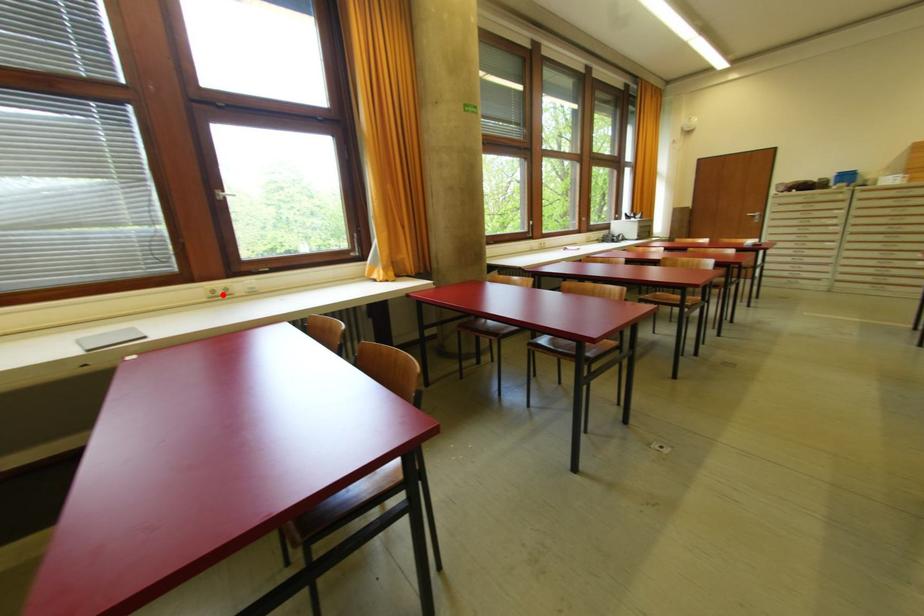
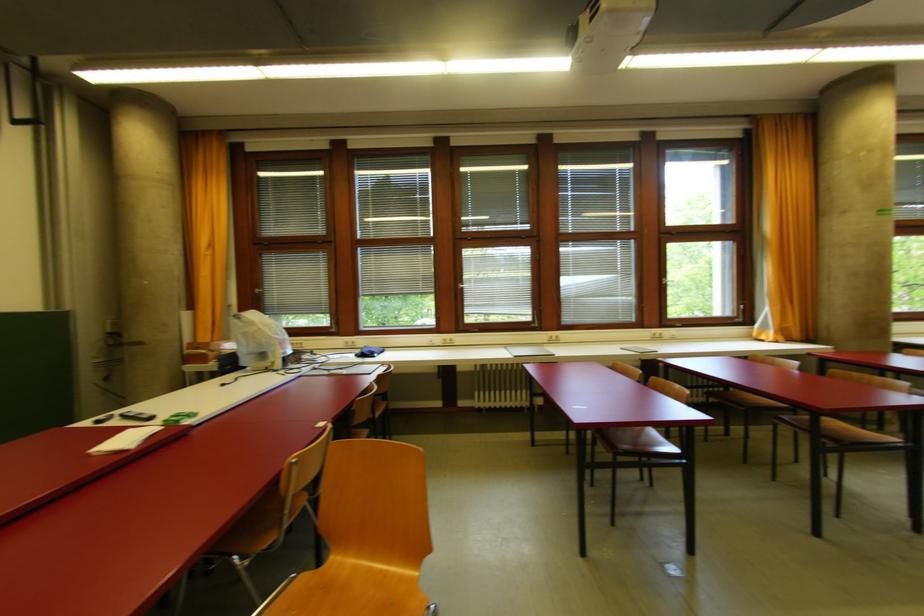
The point at the highlighted location is marked in the first image. Where is the corresponding point in the second image?

(660, 338)